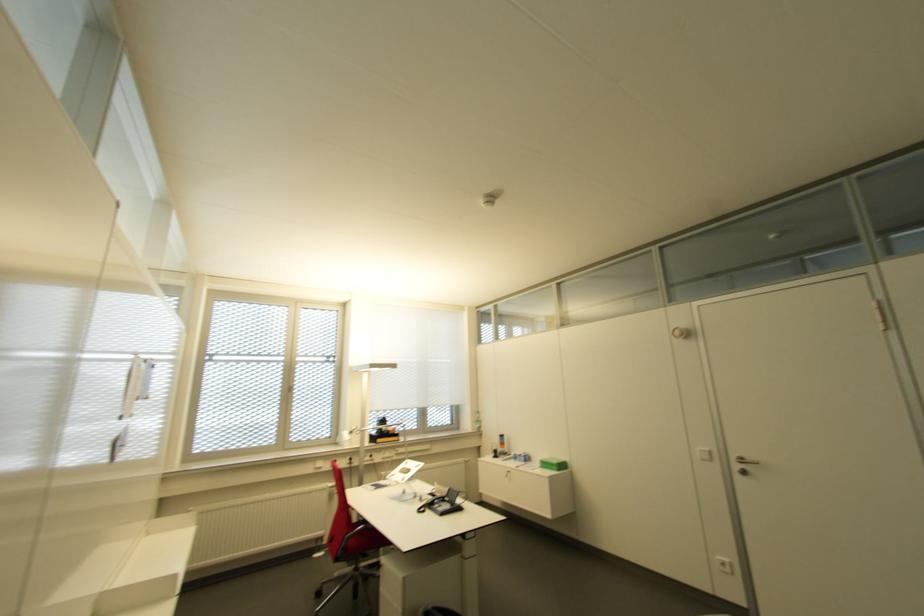
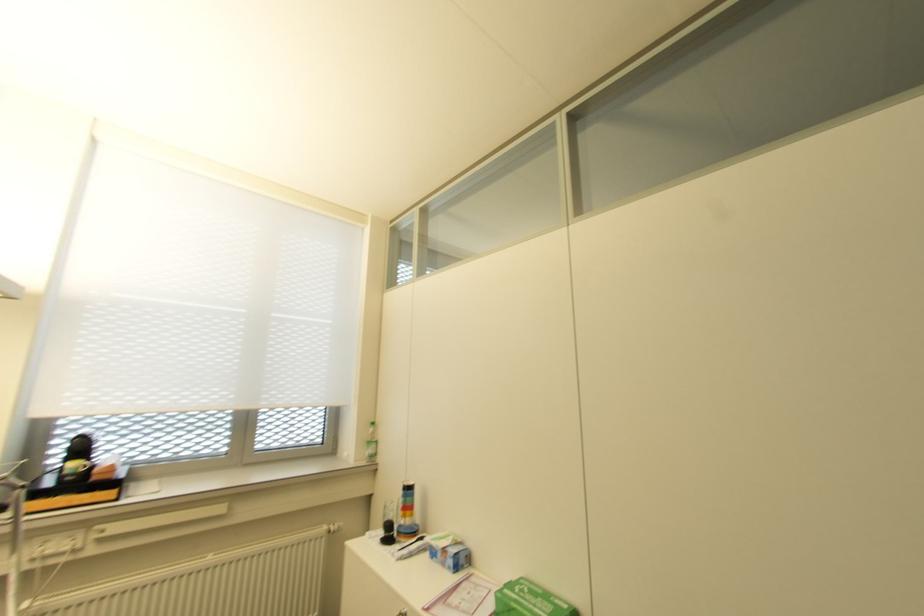
In the second image, find the point that corresponds to [493,456] in the first image.

(385, 540)